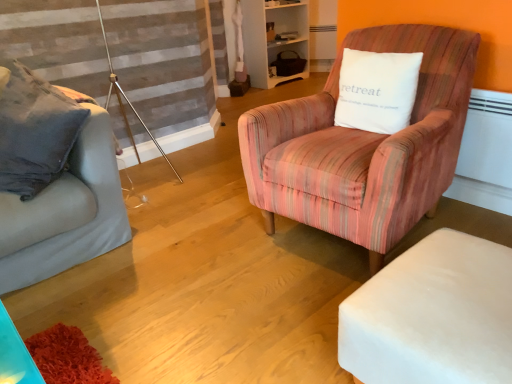
Image resolution: width=512 pixels, height=384 pixels. In order to click on pink striped fabric armchair at center in this screenshot , I will do `click(364, 146)`.

What are the coordinates of `matte gray couch at left` in the screenshot? It's located at (66, 213).

From the image's perspective, would you say white wood bookshelf at upper center is positioned over white fabric ottoman at lower right?

Correct, white wood bookshelf at upper center appears higher than white fabric ottoman at lower right in the image.

Can you tell me how much white wood bookshelf at upper center and white fabric ottoman at lower right differ in facing direction?

180 degrees separate the facing orientations of white wood bookshelf at upper center and white fabric ottoman at lower right.

Is white wood bookshelf at upper center oriented towards white fabric ottoman at lower right?

No, white wood bookshelf at upper center does not turn towards white fabric ottoman at lower right.

Which is in front, white soft cushion at upper right or white fabric ottoman at lower right?

white fabric ottoman at lower right is more forward.

Is point (381, 75) in front of point (444, 236)?

No, it is behind (444, 236).

From the picture: From a real-world perspective, relative to white fabric ottoman at lower right, is white soft cushion at upper right vertically above or below?

In terms of real-world spatial position, white soft cushion at upper right is above white fabric ottoman at lower right.

Are white soft cushion at upper right and white fabric ottoman at lower right beside each other?

No, white soft cushion at upper right is not next to white fabric ottoman at lower right.

Based on the photo, is white wood bookshelf at upper center taller or shorter than white soft cushion at upper right?

In the image, white wood bookshelf at upper center appears to be taller than white soft cushion at upper right.

Considering the sizes of objects white wood bookshelf at upper center and white soft cushion at upper right in the image provided, who is thinner, white wood bookshelf at upper center or white soft cushion at upper right?

white soft cushion at upper right.

Does white wood bookshelf at upper center have a larger size compared to white soft cushion at upper right?

Yes, white wood bookshelf at upper center is bigger than white soft cushion at upper right.

Is white wood bookshelf at upper center beside white soft cushion at upper right?

There is a gap between white wood bookshelf at upper center and white soft cushion at upper right.

Would you say pink striped fabric armchair at center is a long distance from matte gray couch at left?

pink striped fabric armchair at center is actually quite close to matte gray couch at left.

Considering the sizes of objects pink striped fabric armchair at center and matte gray couch at left in the image provided, who is smaller, pink striped fabric armchair at center or matte gray couch at left?

matte gray couch at left.

Is pink striped fabric armchair at center surrounding matte gray couch at left?

Actually, matte gray couch at left is outside pink striped fabric armchair at center.

From the image's perspective, does matte gray couch at left appear higher than white soft cushion at upper right?

No.

Can you confirm if matte gray couch at left is wider than white soft cushion at upper right?

Yes, matte gray couch at left is wider than white soft cushion at upper right.

In the image, is matte gray couch at left on the left side or the right side of white soft cushion at upper right?

Clearly, matte gray couch at left is on the left of white soft cushion at upper right in the image.

From the picture: Which of these two, white fabric ottoman at lower right or white soft cushion at upper right, is thinner?

white soft cushion at upper right.

Is white fabric ottoman at lower right not close to white soft cushion at upper right?

That's not correct — white fabric ottoman at lower right is a little close to white soft cushion at upper right.

Looking at this image, from a real-world perspective, which object rests below the other?

white fabric ottoman at lower right.

Who is shorter, white fabric ottoman at lower right or white soft cushion at upper right?

white fabric ottoman at lower right.

Is white soft cushion at upper right positioned behind white wood bookshelf at upper center?

That is False.

From the image's perspective, is white soft cushion at upper right positioned above or below white wood bookshelf at upper center?

Clearly, from the image's perspective, white soft cushion at upper right is below white wood bookshelf at upper center.

Is point (385, 129) closer to viewer compared to point (257, 1)?

Yes, it is.

Considering the relative sizes of white soft cushion at upper right and white wood bookshelf at upper center in the image provided, is white soft cushion at upper right bigger than white wood bookshelf at upper center?

No, white soft cushion at upper right is not bigger than white wood bookshelf at upper center.

Find the location of `bookshelf that is on the left side of white fabric ottoman at lower right`. bookshelf that is on the left side of white fabric ottoman at lower right is located at coordinates (273, 40).

This screenshot has height=384, width=512. What are the coordinates of `pillow lying behind the white fabric ottoman at lower right` in the screenshot? It's located at (377, 90).

Looking at the image, which one is located further to white wood bookshelf at upper center, white fabric ottoman at lower right or white soft cushion at upper right?

The object further to white wood bookshelf at upper center is white fabric ottoman at lower right.

Looking at the image, which one is located further to white soft cushion at upper right, white fabric ottoman at lower right or white wood bookshelf at upper center?

Based on the image, white wood bookshelf at upper center appears to be further to white soft cushion at upper right.

Which object lies further to the anchor point white soft cushion at upper right, white wood bookshelf at upper center or white fabric ottoman at lower right?

white wood bookshelf at upper center.

Estimate the real-world distances between objects in this image. Which object is closer to white fabric ottoman at lower right, white wood bookshelf at upper center or matte gray couch at left?

Based on the image, matte gray couch at left appears to be nearer to white fabric ottoman at lower right.

Which object lies further to the anchor point matte gray couch at left, white fabric ottoman at lower right or white wood bookshelf at upper center?

Based on the image, white wood bookshelf at upper center appears to be further to matte gray couch at left.

When comparing their distances from white wood bookshelf at upper center, does pink striped fabric armchair at center or white soft cushion at upper right seem further?

The object further to white wood bookshelf at upper center is pink striped fabric armchair at center.

Based on their spatial positions, is white soft cushion at upper right or white fabric ottoman at lower right closer to pink striped fabric armchair at center?

white soft cushion at upper right lies closer to pink striped fabric armchair at center than the other object.

When comparing their distances from white fabric ottoman at lower right, does matte gray couch at left or white soft cushion at upper right seem further?

Among the two, matte gray couch at left is located further to white fabric ottoman at lower right.

Image resolution: width=512 pixels, height=384 pixels. Find the location of `chair situated between matte gray couch at left and white fabric ottoman at lower right from left to right`. chair situated between matte gray couch at left and white fabric ottoman at lower right from left to right is located at coordinates (364, 146).

Locate an element on the screen. Image resolution: width=512 pixels, height=384 pixels. pillow positioned between white fabric ottoman at lower right and white wood bookshelf at upper center from near to far is located at coordinates (377, 90).

At what (x,y) coordinates should I click in order to perform the action: click on pillow between matte gray couch at left and white fabric ottoman at lower right. Please return your answer as a coordinate pair (x, y). Image resolution: width=512 pixels, height=384 pixels. Looking at the image, I should click on (377, 90).

The width and height of the screenshot is (512, 384). Find the location of `chair that lies between white soft cushion at upper right and white fabric ottoman at lower right from top to bottom`. chair that lies between white soft cushion at upper right and white fabric ottoman at lower right from top to bottom is located at coordinates (364, 146).